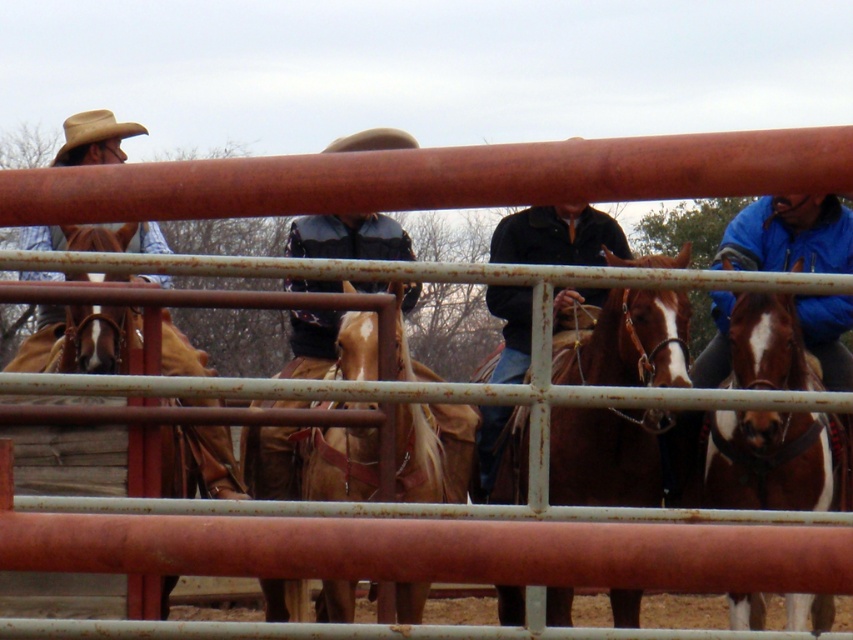
You are a photographer standing behind the red fence in the image. You want to take a photo of the leather jacket at center without the brown glossy horse at right blocking it. Is the horse currently blocking the jacket?

The brown glossy horse at right is in front of the leather jacket at center, so yes, the horse is blocking the jacket.

You are standing at the center of the corral and see the point marked at coordinates (606,456). What object is located at that point?

The point at coordinates (606,456) corresponds to the brown leather horse at center.